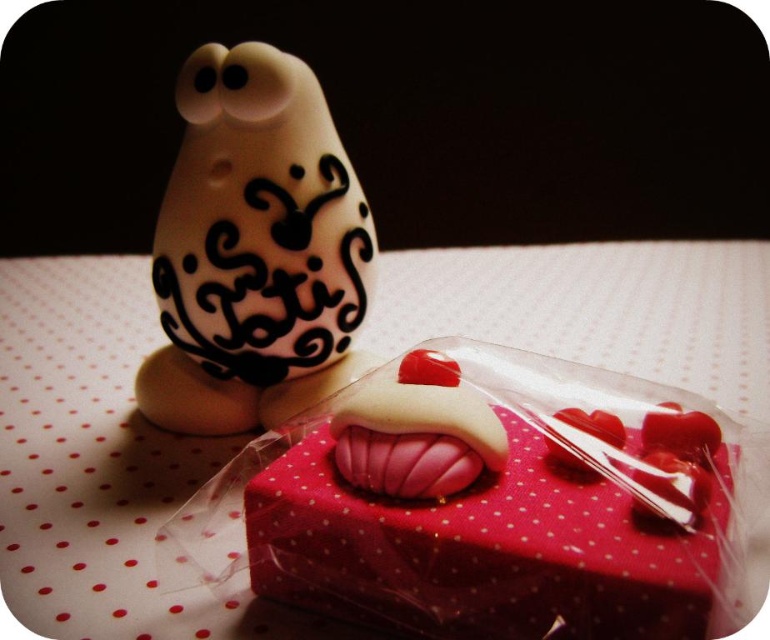
Can you confirm if matte pink fabric box at center is shorter than white glossy figurine at upper left?

Yes.

At what (x,y) coordinates should I click in order to perform the action: click on matte pink fabric box at center. Please return your answer as a coordinate pair (x, y). Looking at the image, I should click on (507, 509).

You are a GUI agent. You are given a task and a screenshot of the screen. Output one action in this format:
    pyautogui.click(x=<x>, y=<y>)
    Task: Click on the matte pink fabric box at center
    
    Given the screenshot: What is the action you would take?
    pyautogui.click(x=507, y=509)